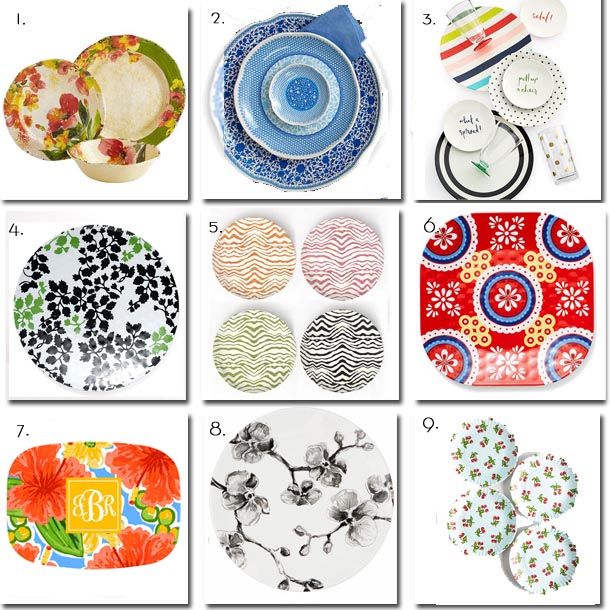
Where is `drinking glasses`? The width and height of the screenshot is (610, 610). drinking glasses is located at coordinates (504, 138), (556, 141), (476, 26).